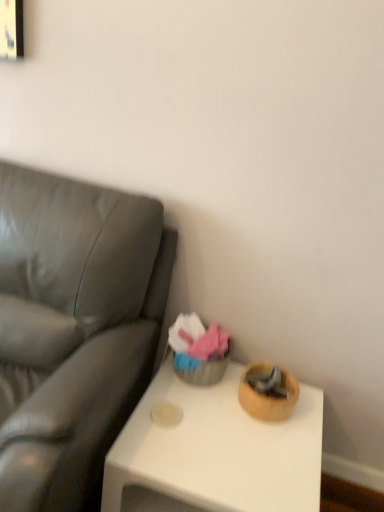
Question: Considering the positions of point click(291, 503) and point click(24, 229), is point click(291, 503) closer or farther from the camera than point click(24, 229)?

Choices:
 (A) closer
 (B) farther

Answer: (A)

Question: Is wooden bowl at lower right in front of or behind leather-like gray couch at left in the image?

Choices:
 (A) front
 (B) behind

Answer: (B)

Question: From the image's perspective, is wooden bowl at lower right positioned above or below leather-like gray couch at left?

Choices:
 (A) above
 (B) below

Answer: (B)

Question: Is point (84, 249) positioned closer to the camera than point (231, 382)?

Choices:
 (A) farther
 (B) closer

Answer: (B)

Question: Considering their positions, is leather-like gray couch at left located in front of or behind wooden bowl at lower right?

Choices:
 (A) behind
 (B) front

Answer: (B)

Question: From the image's perspective, is leather-like gray couch at left above or below wooden bowl at lower right?

Choices:
 (A) below
 (B) above

Answer: (B)

Question: From a real-world perspective, is leather-like gray couch at left above or below wooden bowl at lower right?

Choices:
 (A) below
 (B) above

Answer: (B)